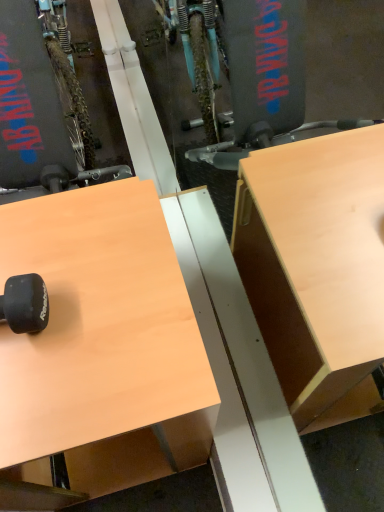
This screenshot has width=384, height=512. In order to click on vacant region above light brown wood desk at upper left (from a real-world perspective) in this screenshot , I will do tap(69, 289).